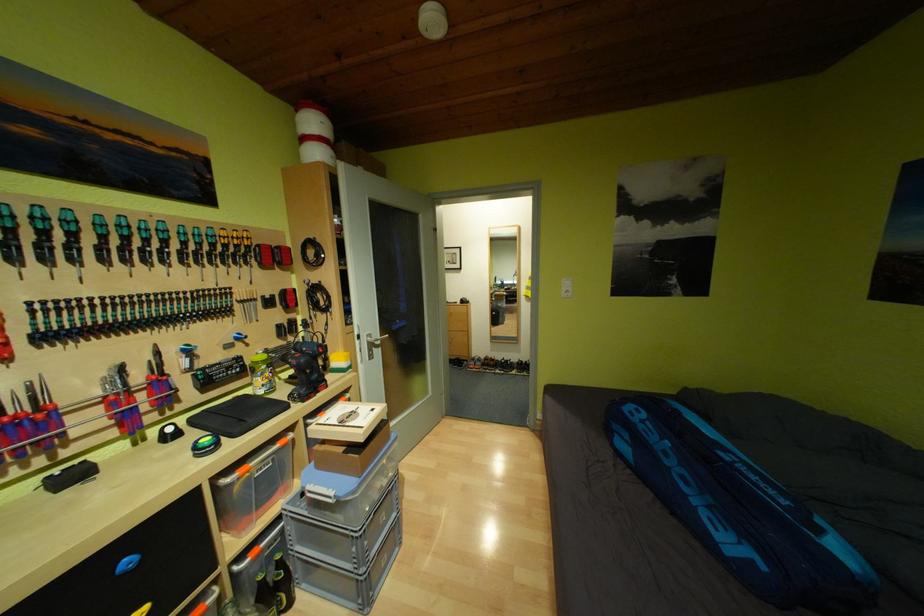
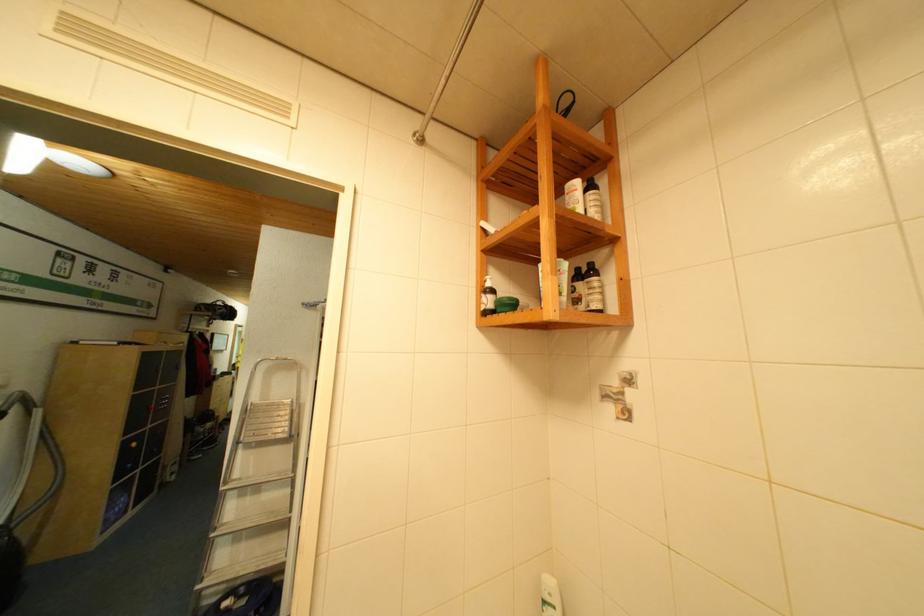
Question: I am providing you with two images of the same scene from different viewpoints. Which of the following objects are not visible in image2?

Choices:
 (A) metal wall fixture
 (B) dark brown bottle
 (C) green glass bottle
 (D) red wine bottle

Answer: (C)